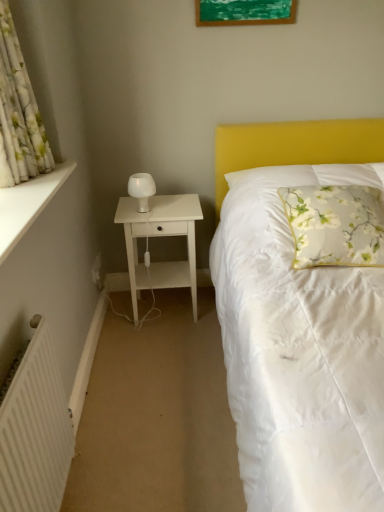
The width and height of the screenshot is (384, 512). I want to click on free space in front of white matte nightstand at left, so click(162, 357).